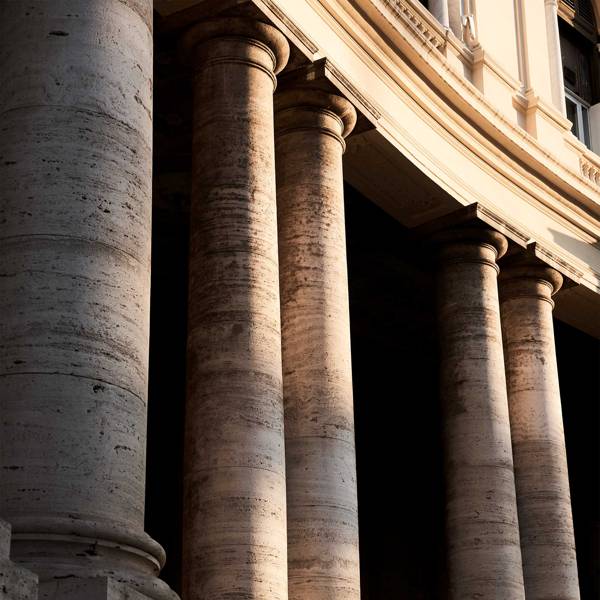
Find the location of a particular element. door is located at coordinates (575, 116).